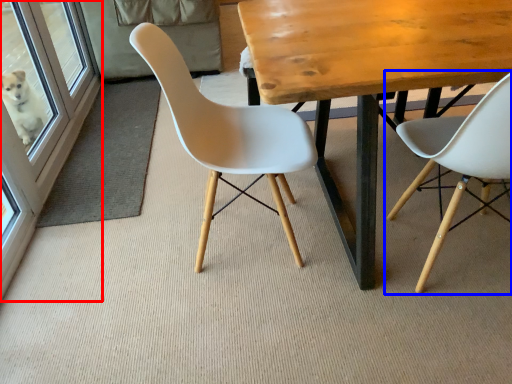
Question: Which object appears closest to the camera in this image, screen door (highlighted by a red box) or chair (highlighted by a blue box)?

Choices:
 (A) screen door
 (B) chair

Answer: (B)